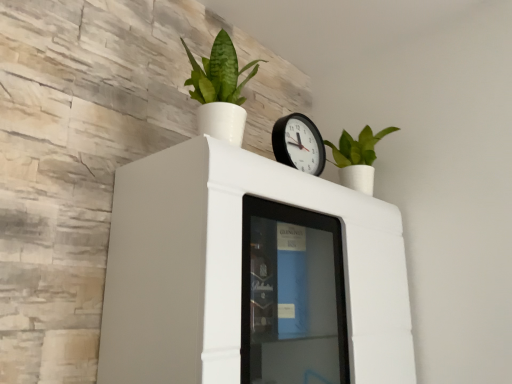
Question: Looking at the image, does white glossy cabinet at upper center seem bigger or smaller compared to green matte plant at upper right, the second houseplant viewed from the left?

Choices:
 (A) big
 (B) small

Answer: (A)

Question: From a real-world perspective, is white glossy cabinet at upper center above or below green matte plant at upper right, placed as the first houseplant when sorted from back to front?

Choices:
 (A) below
 (B) above

Answer: (A)

Question: Which object is the closest to the green matte plant at upper center, marked as the first houseplant in a front-to-back arrangement?

Choices:
 (A) green matte plant at upper right, the second houseplant viewed from the left
 (B) black plastic wall clock at upper center
 (C) white glossy cabinet at upper center

Answer: (B)

Question: Which of these objects is positioned farthest from the green matte plant at upper right, placed as the first houseplant when sorted from back to front?

Choices:
 (A) white glossy cabinet at upper center
 (B) green matte plant at upper center, placed as the 2th houseplant when sorted from right to left
 (C) black plastic wall clock at upper center

Answer: (B)